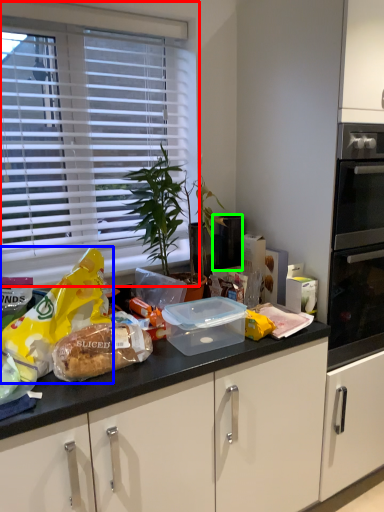
Question: Based on their relative distances, which object is farther from window blind (highlighted by a red box)? Choose from snack (highlighted by a blue box) and appliance (highlighted by a green box).

Choices:
 (A) snack
 (B) appliance

Answer: (B)